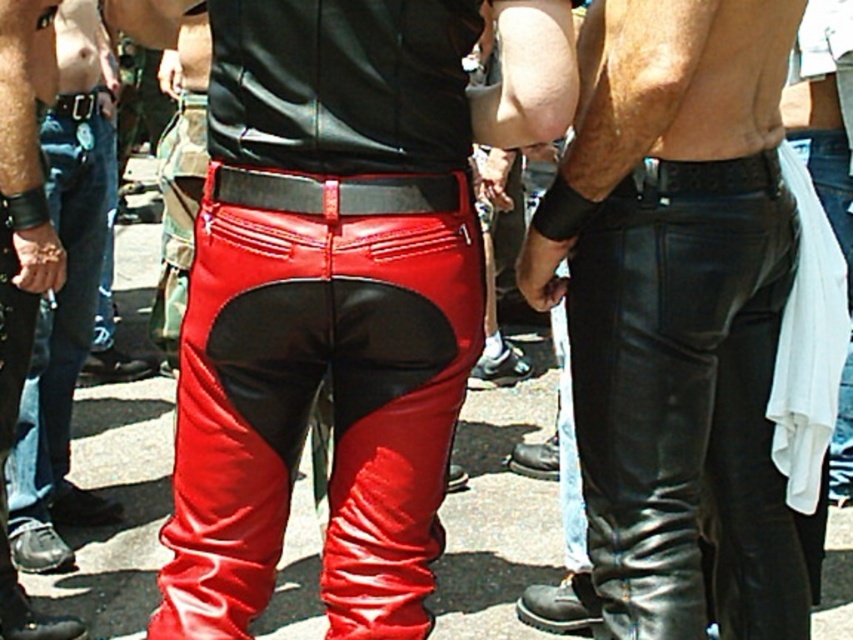
Is shiny leather pants at center thinner than black leather belt at center?

Incorrect, shiny leather pants at center's width is not less than black leather belt at center's.

Looking at this image, how distant is shiny leather pants at center from black leather belt at center?

The distance of shiny leather pants at center from black leather belt at center is 12.09 inches.

Consider the image. Who is more forward, (233, 352) or (293, 192)?

Point (293, 192)

Image resolution: width=853 pixels, height=640 pixels. I want to click on shiny leather pants at center, so click(x=338, y=291).

Is point (55, 467) closer to camera compared to point (271, 200)?

No, it is behind (271, 200).

Which is behind, point (71, 305) or point (254, 192)?

The point (71, 305) is more distant.

Does point (26, 435) lie in front of point (308, 202)?

No, it is behind (308, 202).

This screenshot has height=640, width=853. What are the coordinates of `shiny red leather pants at center` in the screenshot? It's located at (62, 304).

Does shiny leather pants at center appear on the left side of shiny red leather pants at center?

Incorrect, shiny leather pants at center is not on the left side of shiny red leather pants at center.

Does shiny leather pants at center have a lesser width compared to shiny red leather pants at center?

In fact, shiny leather pants at center might be wider than shiny red leather pants at center.

Measure the distance between shiny leather pants at center and camera.

shiny leather pants at center and camera are 2.31 meters apart from each other.

Image resolution: width=853 pixels, height=640 pixels. In order to click on shiny leather pants at center in this screenshot , I will do `click(338, 291)`.